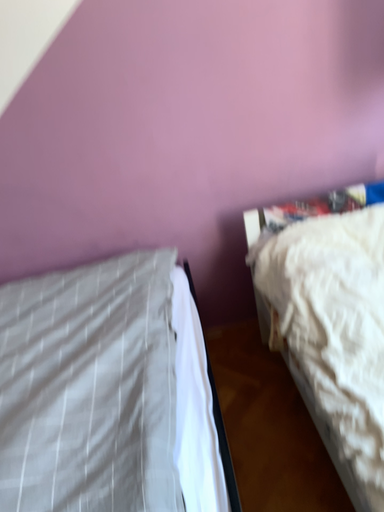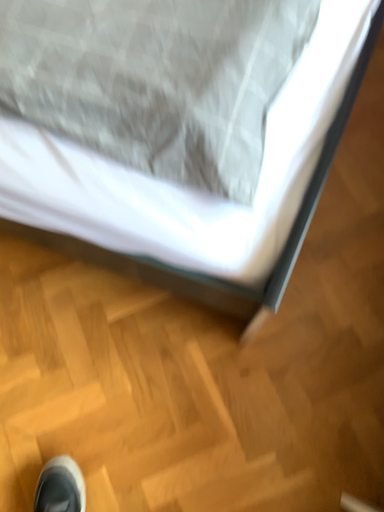
Question: How did the camera likely rotate when shooting the video?

Choices:
 (A) rotated left
 (B) rotated right

Answer: (A)